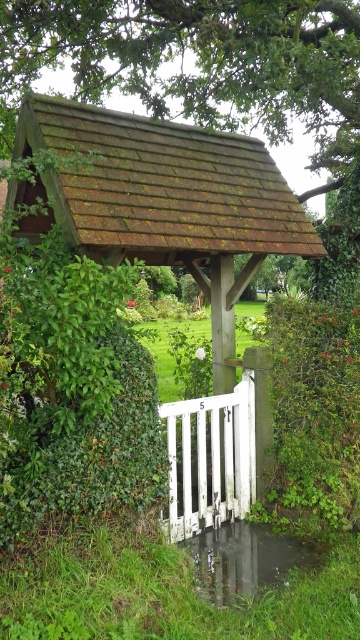
Question: Among these points, which one is nearest to the camera?

Choices:
 (A) (216, 22)
 (B) (221, 516)
 (C) (222, 525)

Answer: (B)

Question: Does green mossy roof at upper center appear on the left side of white painted wood gate at center?

Choices:
 (A) yes
 (B) no

Answer: (B)

Question: Can you confirm if green mossy roof at upper center is bigger than glossy concrete puddle at lower center?

Choices:
 (A) no
 (B) yes

Answer: (B)

Question: Which object appears farthest from the camera in this image?

Choices:
 (A) white painted wood gate at center
 (B) glossy concrete puddle at lower center

Answer: (A)

Question: Which point is farther to the camera?

Choices:
 (A) (199, 541)
 (B) (11, 96)

Answer: (B)

Question: Can you confirm if green mossy roof at upper center is thinner than white painted wood gate at center?

Choices:
 (A) no
 (B) yes

Answer: (B)